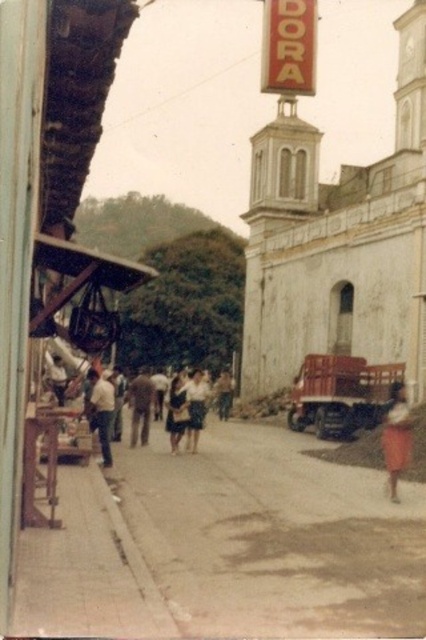
Looking at this image, who is more forward, [112,410] or [51,372]?

Point [112,410] is more forward.

Can you confirm if white matte shirt at center is taller than white cotton shirt at center?

Indeed, white matte shirt at center has a greater height compared to white cotton shirt at center.

Based on the photo, measure the distance between white matte shirt at center and camera.

white matte shirt at center and camera are 66.53 meters apart.

You are a GUI agent. You are given a task and a screenshot of the screen. Output one action in this format:
    pyautogui.click(x=<x>, y=<y>)
    Task: Click on the white matte shirt at center
    The image size is (426, 640).
    Given the screenshot: What is the action you would take?
    pyautogui.click(x=100, y=412)

Who is higher up, dull gray asphalt at center or white matte shirt at center?

white matte shirt at center is above.

Is dull gray asphalt at center thinner than white matte shirt at center?

No.

This screenshot has width=426, height=640. What do you see at coordinates (275, 538) in the screenshot?
I see `dull gray asphalt at center` at bounding box center [275, 538].

Where is `dull gray asphalt at center`? This screenshot has width=426, height=640. dull gray asphalt at center is located at coordinates (275, 538).

Does dull gray asphalt at center have a smaller size compared to brown fabric shirt at center?

Indeed, dull gray asphalt at center has a smaller size compared to brown fabric shirt at center.

At what (x,y) coordinates should I click in order to perform the action: click on dull gray asphalt at center. Please return your answer as a coordinate pair (x, y). The height and width of the screenshot is (640, 426). Looking at the image, I should click on (275, 538).

You are a GUI agent. You are given a task and a screenshot of the screen. Output one action in this format:
    pyautogui.click(x=<x>, y=<y>)
    Task: Click on the dull gray asphalt at center
    The image size is (426, 640).
    Given the screenshot: What is the action you would take?
    pyautogui.click(x=275, y=538)